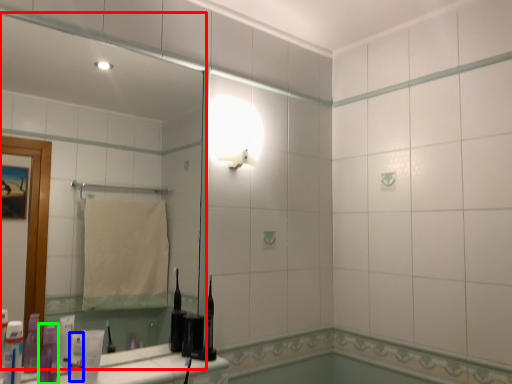
Question: Which object is the farthest from mirror (highlighted by a red box)? Choose among these: toiletry (highlighted by a blue box) or toiletry (highlighted by a green box).

Choices:
 (A) toiletry
 (B) toiletry

Answer: (A)